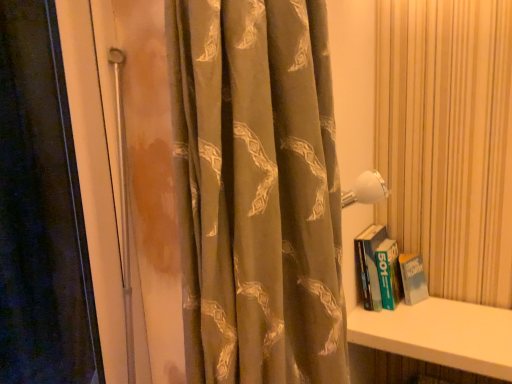
Question: Is white smooth shelf at lower right not close to silky brown curtain at center?

Choices:
 (A) yes
 (B) no

Answer: (B)

Question: From the image's perspective, does white smooth shelf at lower right appear higher than silky brown curtain at center?

Choices:
 (A) no
 (B) yes

Answer: (A)

Question: From a real-world perspective, is white smooth shelf at lower right located beneath silky brown curtain at center?

Choices:
 (A) yes
 (B) no

Answer: (A)

Question: Is white smooth shelf at lower right positioned before silky brown curtain at center?

Choices:
 (A) no
 (B) yes

Answer: (A)

Question: Considering the relative sizes of white smooth shelf at lower right and silky brown curtain at center in the image provided, is white smooth shelf at lower right taller than silky brown curtain at center?

Choices:
 (A) no
 (B) yes

Answer: (A)

Question: Is white smooth shelf at lower right shorter than silky brown curtain at center?

Choices:
 (A) yes
 (B) no

Answer: (A)

Question: Is silky brown curtain at center wider than white smooth shelf at lower right?

Choices:
 (A) no
 (B) yes

Answer: (A)

Question: Can you see silky brown curtain at center touching white smooth shelf at lower right?

Choices:
 (A) yes
 (B) no

Answer: (B)

Question: Is silky brown curtain at center at the left side of white smooth shelf at lower right?

Choices:
 (A) no
 (B) yes

Answer: (B)

Question: Would you consider silky brown curtain at center to be distant from white smooth shelf at lower right?

Choices:
 (A) yes
 (B) no

Answer: (B)

Question: Does silky brown curtain at center come behind white smooth shelf at lower right?

Choices:
 (A) no
 (B) yes

Answer: (A)

Question: From the image's perspective, is silky brown curtain at center located above white smooth shelf at lower right?

Choices:
 (A) no
 (B) yes

Answer: (B)

Question: Can you confirm if white smooth shelf at lower right is wider than green matte book at right?

Choices:
 (A) yes
 (B) no

Answer: (A)